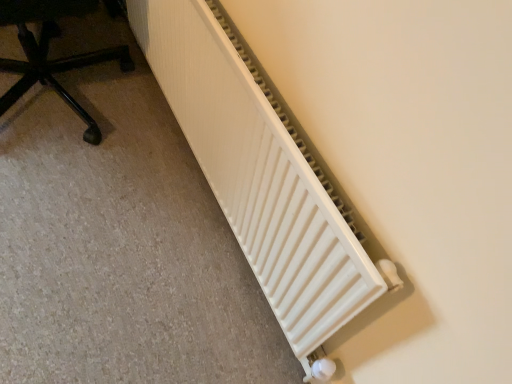
Question: Relative to black plastic chair at lower left, is white matte radiator at lower right in front or behind?

Choices:
 (A) behind
 (B) front

Answer: (B)

Question: Visually, is white matte radiator at lower right positioned to the left or to the right of black plastic chair at lower left?

Choices:
 (A) right
 (B) left

Answer: (A)

Question: In terms of height, does white matte radiator at lower right look taller or shorter compared to black plastic chair at lower left?

Choices:
 (A) tall
 (B) short

Answer: (A)

Question: Which is correct: black plastic chair at lower left is inside white matte radiator at lower right, or outside of it?

Choices:
 (A) outside
 (B) inside

Answer: (A)

Question: From the image's perspective, relative to white matte radiator at lower right, is black plastic chair at lower left above or below?

Choices:
 (A) above
 (B) below

Answer: (A)

Question: Is black plastic chair at lower left to the left or to the right of white matte radiator at lower right in the image?

Choices:
 (A) right
 (B) left

Answer: (B)

Question: Is black plastic chair at lower left taller or shorter than white matte radiator at lower right?

Choices:
 (A) tall
 (B) short

Answer: (B)